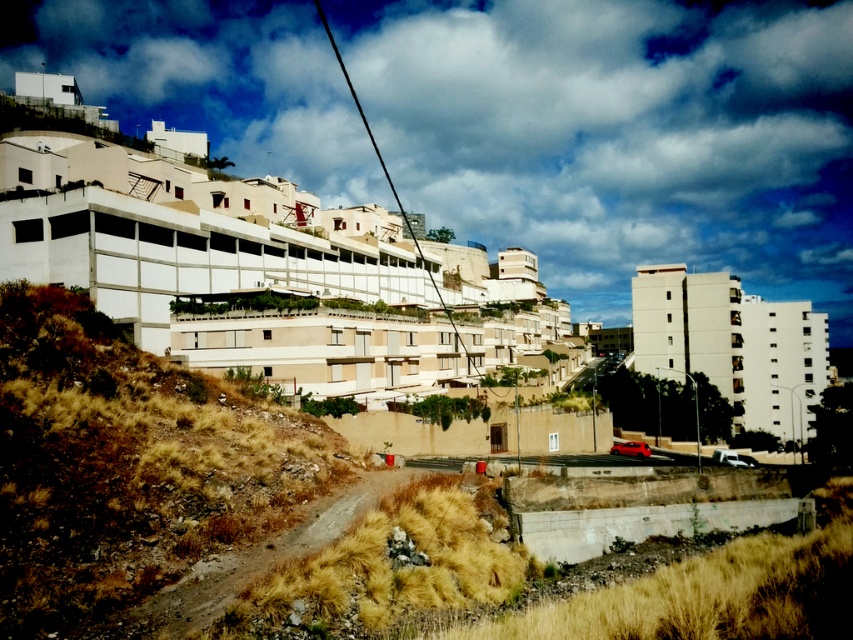
Looking at this image, between brown grassy hillside at lower left and brown gravel path at lower left, which one has more height?

Standing taller between the two is brown grassy hillside at lower left.

Can you confirm if brown grassy hillside at lower left is thinner than brown gravel path at lower left?

No.

Does point (146, 454) come behind point (219, 579)?

Yes.

Locate an element on the screen. The width and height of the screenshot is (853, 640). brown grassy hillside at lower left is located at coordinates (128, 465).

Which is more to the right, brown grassy hillside at lower left or white smooth building at center-right?

From the viewer's perspective, white smooth building at center-right appears more on the right side.

Who is lower down, brown grassy hillside at lower left or white smooth building at center-right?

brown grassy hillside at lower left

Does point (325, 445) lie in front of point (676, 292)?

Yes, it is.

Where is `brown grassy hillside at lower left`? This screenshot has width=853, height=640. brown grassy hillside at lower left is located at coordinates (128, 465).

Can you confirm if white smooth building at center-right is bigger than brown gravel path at lower left?

Yes, white smooth building at center-right is bigger than brown gravel path at lower left.

Describe the element at coordinates (732, 344) in the screenshot. I see `white smooth building at center-right` at that location.

The width and height of the screenshot is (853, 640). Find the location of `white smooth building at center-right`. white smooth building at center-right is located at coordinates (732, 344).